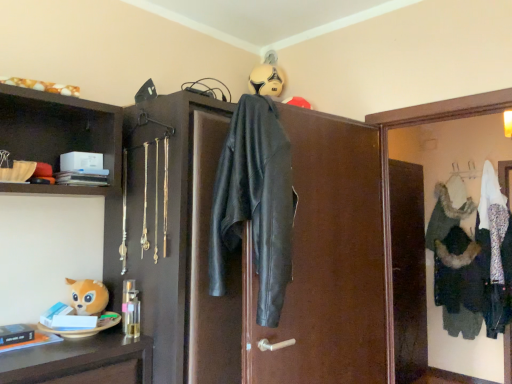
What do you see at coordinates (495, 252) in the screenshot?
I see `white fur coat at center` at bounding box center [495, 252].

Measure the distance between point (453, 104) and camera.

Point (453, 104) and camera are 1.88 meters apart from each other.

Describe the element at coordinates (388, 171) in the screenshot. The width and height of the screenshot is (512, 384). I see `white fabric medicine cabinet at upper right` at that location.

Measure the distance between point (x=218, y=220) and camera.

The depth of point (x=218, y=220) is 1.46 meters.

The image size is (512, 384). What do you see at coordinates (255, 203) in the screenshot?
I see `black leather jacket at center` at bounding box center [255, 203].

The image size is (512, 384). Find the location of `white fur coat at center`. white fur coat at center is located at coordinates (495, 252).

Are white fabric medicine cabinet at upper right and white fur coat at center beside each other?

No, white fabric medicine cabinet at upper right is not in contact with white fur coat at center.

Consider the image. Considering the relative sizes of white fabric medicine cabinet at upper right and white fur coat at center in the image provided, is white fabric medicine cabinet at upper right thinner than white fur coat at center?

Indeed, white fabric medicine cabinet at upper right has a lesser width compared to white fur coat at center.

From the image's perspective, which is above, white fabric medicine cabinet at upper right or white fur coat at center?

white fabric medicine cabinet at upper right appears higher in the image.

Is white fabric medicine cabinet at upper right oriented away from white fur coat at center?

That's right, white fabric medicine cabinet at upper right is facing away from white fur coat at center.

Consider the image. Is black leather jacket at center situated inside white fabric medicine cabinet at upper right or outside?

black leather jacket at center is outside white fabric medicine cabinet at upper right.

In the scene shown: Considering the positions of objects black leather jacket at center and white fabric medicine cabinet at upper right in the image provided, who is behind, black leather jacket at center or white fabric medicine cabinet at upper right?

white fabric medicine cabinet at upper right.

Is point (227, 192) closer or farther from the camera than point (482, 112)?

Clearly, point (227, 192) is closer to the camera than point (482, 112).

Considering the sizes of black leather jacket at center and white fabric medicine cabinet at upper right in the image, is black leather jacket at center taller or shorter than white fabric medicine cabinet at upper right?

In the image, black leather jacket at center appears to be shorter than white fabric medicine cabinet at upper right.

Is white fur coat at center next to black leather jacket at center?

No.

Considering their positions, is white fur coat at center located in front of or behind black leather jacket at center?

white fur coat at center is positioned farther from the viewer than black leather jacket at center.

From a real-world perspective, is white fur coat at center under black leather jacket at center?

Yes, from a real-world perspective, white fur coat at center is under black leather jacket at center.

Is white fabric medicine cabinet at upper right facing towards black leather jacket at center?

Yes.

Is white fabric medicine cabinet at upper right further to camera compared to black leather jacket at center?

Yes.

Are white fabric medicine cabinet at upper right and black leather jacket at center making contact?

No, white fabric medicine cabinet at upper right is not making contact with black leather jacket at center.

Which is behind, point (456, 109) or point (302, 180)?

The point (456, 109) is farther.

Considering the relative sizes of black leather jacket at center and white fur coat at center in the image provided, is black leather jacket at center wider than white fur coat at center?

No, black leather jacket at center is not wider than white fur coat at center.

Considering the relative sizes of black leather jacket at center and white fur coat at center in the image provided, is black leather jacket at center bigger than white fur coat at center?

Correct, black leather jacket at center is larger in size than white fur coat at center.

Can you confirm if black leather jacket at center is taller than white fur coat at center?

No, black leather jacket at center is not taller than white fur coat at center.

What's the angular difference between black leather jacket at center and white fur coat at center's facing directions?

84.4 degrees separate the facing orientations of black leather jacket at center and white fur coat at center.

Which of these two, white fur coat at center or white fabric medicine cabinet at upper right, stands taller?

white fur coat at center.

From the image's perspective, is white fur coat at center above white fabric medicine cabinet at upper right?

No, from the image's perspective, white fur coat at center is not above white fabric medicine cabinet at upper right.

Is white fur coat at center wider than white fabric medicine cabinet at upper right?

Yes, white fur coat at center is wider than white fabric medicine cabinet at upper right.

Where is `medicine cabinet that appears above the white fur coat at center (from a real-world perspective)`? This screenshot has height=384, width=512. medicine cabinet that appears above the white fur coat at center (from a real-world perspective) is located at coordinates (388, 171).

Are white fur coat at center and black leather jacket at center beside each other?

No, white fur coat at center is not beside black leather jacket at center.

Which is in front, white fur coat at center or black leather jacket at center?

black leather jacket at center is in front.

Who is smaller, white fur coat at center or black leather jacket at center?

white fur coat at center.

How many degrees apart are the facing directions of white fur coat at center and black leather jacket at center?

There is a 84.4-degree angle between the facing directions of white fur coat at center and black leather jacket at center.

The width and height of the screenshot is (512, 384). What are the coordinates of `medicine cabinet in front of the white fur coat at center` in the screenshot? It's located at [388, 171].

Find the location of a particular element. medicine cabinet below the black leather jacket at center (from a real-world perspective) is located at coordinates (388, 171).

Considering their positions, is white fabric medicine cabinet at upper right positioned further to white fur coat at center than black leather jacket at center?

black leather jacket at center is further to white fur coat at center.

Based on their spatial positions, is black leather jacket at center or white fabric medicine cabinet at upper right closer to white fur coat at center?

white fabric medicine cabinet at upper right lies closer to white fur coat at center than the other object.

Consider the image. When comparing their distances from black leather jacket at center, does white fur coat at center or white fabric medicine cabinet at upper right seem further?

Based on the image, white fur coat at center appears to be further to black leather jacket at center.

Which object lies nearer to the anchor point white fabric medicine cabinet at upper right, black leather jacket at center or white fur coat at center?

Based on the image, black leather jacket at center appears to be nearer to white fabric medicine cabinet at upper right.

Considering their positions, is black leather jacket at center positioned closer to white fabric medicine cabinet at upper right than white fur coat at center?

black leather jacket at center lies closer to white fabric medicine cabinet at upper right than the other object.

Considering their positions, is black leather jacket at center positioned closer to white fur coat at center than black leather jacket at center?

Among the two, black leather jacket at center is located nearer to white fur coat at center.

Which object lies further to the anchor point black leather jacket at center, black leather jacket at center or white fabric medicine cabinet at upper right?

The object further to black leather jacket at center is white fabric medicine cabinet at upper right.

Considering their positions, is white fabric medicine cabinet at upper right positioned further to white fur coat at center than black leather jacket at center?

Among the two, black leather jacket at center is located further to white fur coat at center.

The height and width of the screenshot is (384, 512). I want to click on screen door positioned between black leather jacket at center and white fur coat at center from near to far, so click(x=320, y=256).

At what (x,y) coordinates should I click in order to perform the action: click on medicine cabinet between black leather jacket at center and white fur coat at center along the z-axis. Please return your answer as a coordinate pair (x, y). Looking at the image, I should click on (388, 171).

You are a GUI agent. You are given a task and a screenshot of the screen. Output one action in this format:
    pyautogui.click(x=<x>, y=<y>)
    Task: Click on the medicine cabinet located between black leather jacket at center and white fur coat at center in the depth direction
    
    Given the screenshot: What is the action you would take?
    pyautogui.click(x=388, y=171)

You are a GUI agent. You are given a task and a screenshot of the screen. Output one action in this format:
    pyautogui.click(x=<x>, y=<y>)
    Task: Click on the screen door between black leather jacket at center and white fabric medicine cabinet at upper right in the horizontal direction
    
    Given the screenshot: What is the action you would take?
    pyautogui.click(x=320, y=256)